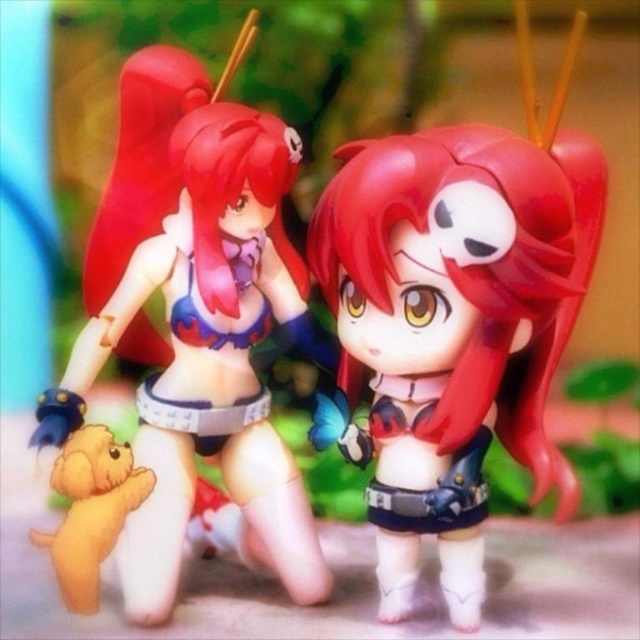
You are an artist trying to sketch the scene. You want to focus on the details of the satin red hair at center and the matte plastic toy at center. Which object should you draw first to ensure proper layering in your sketch?

You should draw the satin red hair at center first because it is closer to the viewer than the matte plastic toy at center, so it should be layered on top.

You are an artist trying to sketch the scene. You need to place the satin red hair at center and the soft yellow plush dog at lower left accurately. Which object should you draw first to ensure proper positioning?

You should draw the soft yellow plush dog at lower left first because the satin red hair at center is positioned on the right side of it, so placing the dog first ensures the red hair can be correctly placed to its right.

You are standing in front of the image of two anime figurines in a garden setting. You notice two points marked in the image. The first point is at coordinates point (452,131) and the second is at point (60,589). Which of these two points is closer to you?

Point (452,131) is closer to the viewer than point (60,589).